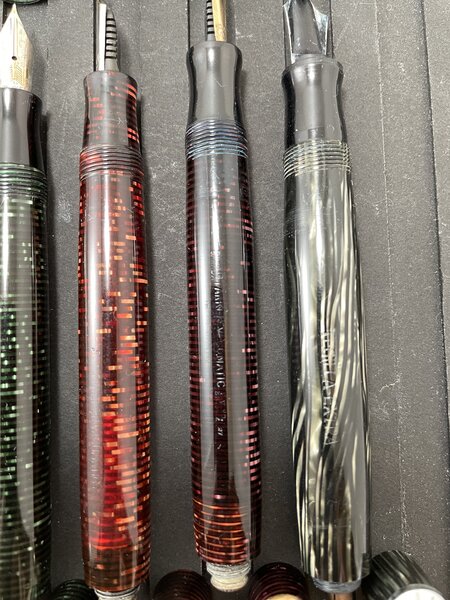
Find the location of a particular element. The image size is (450, 600). table is located at coordinates (385, 128).